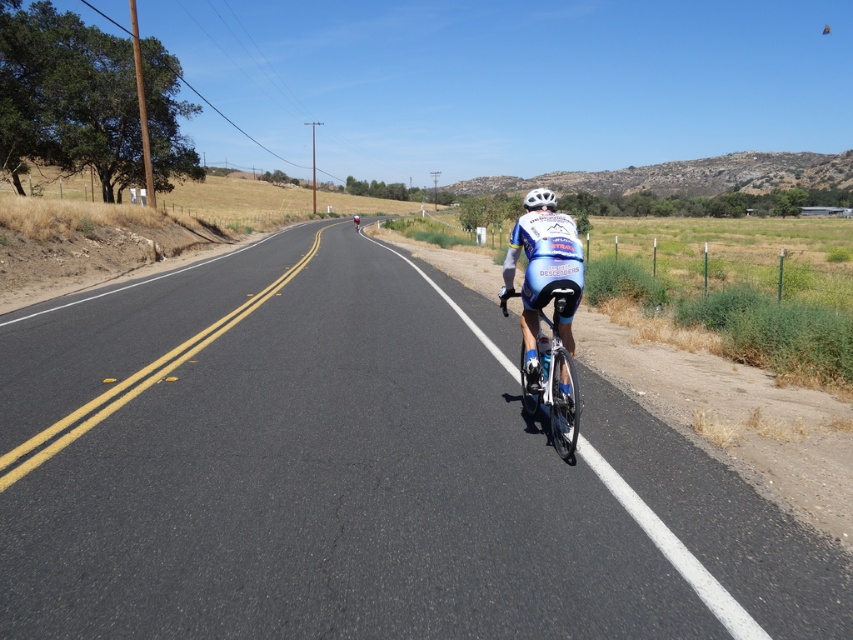
You are a photographer standing at the side of the road during a cycling event. You want to capture a photo of the blue jersey cyclist at center while also including the white matte bicycle helmet at center in the frame. Given their sizes, will the helmet fit entirely within the camera frame if the cyclist takes up the majority of the frame?

The white matte bicycle helmet at center has a smaller width than the blue jersey cyclist at center. Since the helmet is narrower, it should fit within the camera frame even if the cyclist occupies most of the space.

Consider the image. You are a cyclist participating in the event and want to know the distance between your current position and the point marked at coordinates point [547,355]. Can you determine this distance using the information provided?

The distance between the point marked at coordinates point [547,355] and the camera is 5.84 meters. Since the camera is capturing the scene from your current position, the distance between your current position and the point is 5.84 meters.